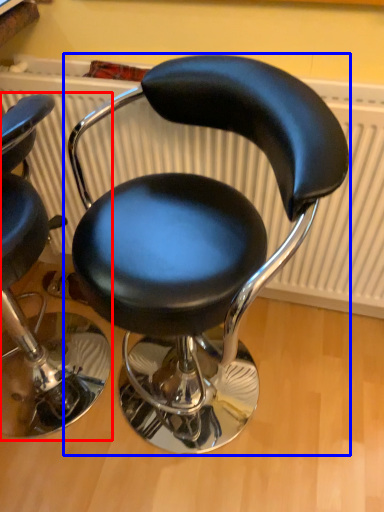
Question: Which object appears closest to the camera in this image, chair (highlighted by a red box) or chair (highlighted by a blue box)?

Choices:
 (A) chair
 (B) chair

Answer: (B)